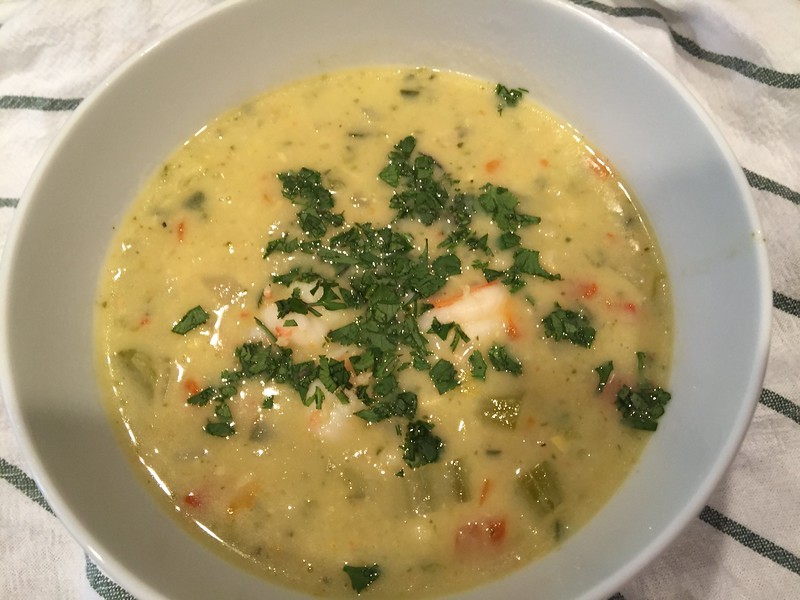
Where is `1 light source`? The height and width of the screenshot is (600, 800). 1 light source is located at coordinates (46, 32).